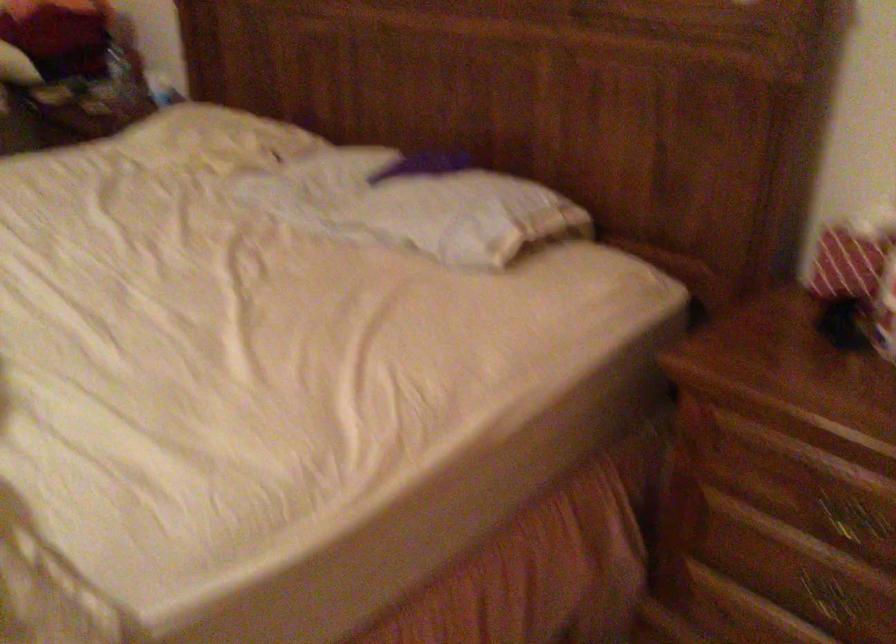
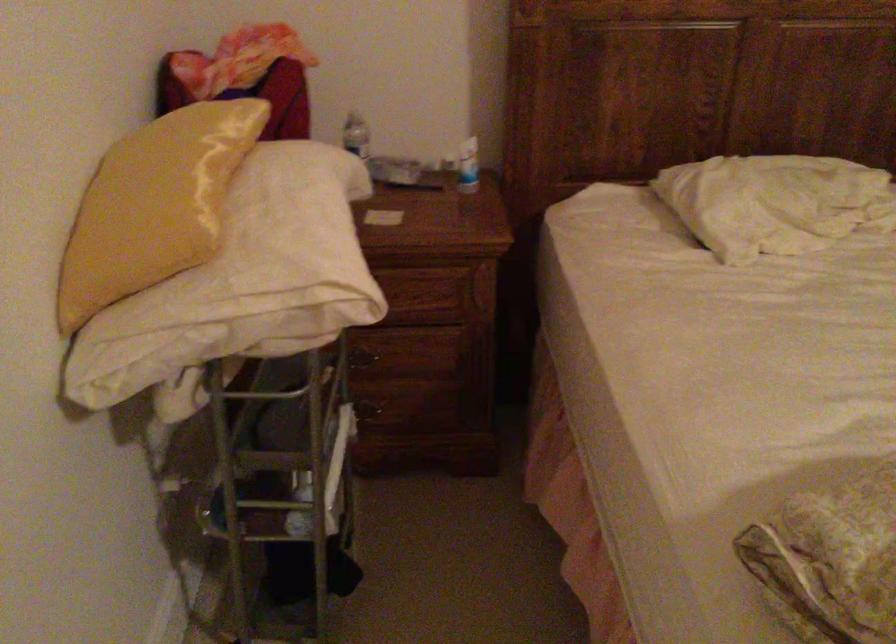
Where in the second image is the point corresponding to point 164,82 from the first image?

(468, 166)